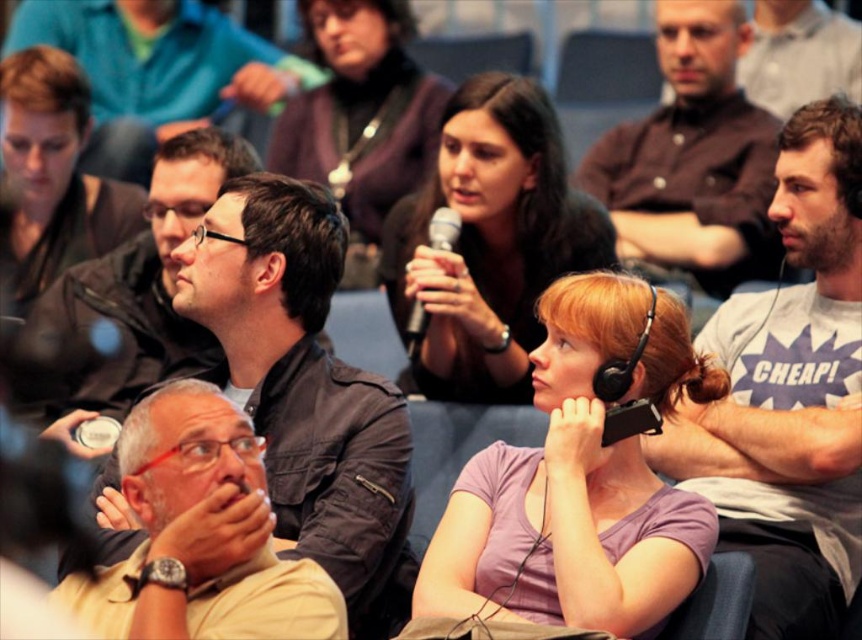
You are organizing a charity event and need to decide which of the two shirts, the tan fabric shirt at lower left or the matte black shirt at upper center, would be more comfortable for a long presentation. Based on their thickness, which one should you choose?

The tan fabric shirt at lower left is thinner than the matte black shirt at upper center, so the tan fabric shirt at lower left would be more comfortable for a long presentation due to its lighter material.

You are a photographer trying to capture a photo of the matte black jacket at center without including the matte black shirt at upper center in the frame. Is this possible based on their positions?

The matte black shirt at upper center is further to the viewer than the matte black jacket at center, so it would block the view of the jacket. Therefore, it is not possible to capture the matte black jacket at center without including the matte black shirt at upper center in the frame.

You are a photographer standing at the back of the auditorium and want to take a photo of the matte black shirt at upper center. The camera you have requires you to be within 7 meters to capture a clear image. Can you take a clear photo from your current position?

The matte black shirt at upper center and the camera are 7.08 meters apart from each other. Since the camera requires being within 7 meters for a clear image, the distance is slightly too far. You cannot take a clear photo from your current position.